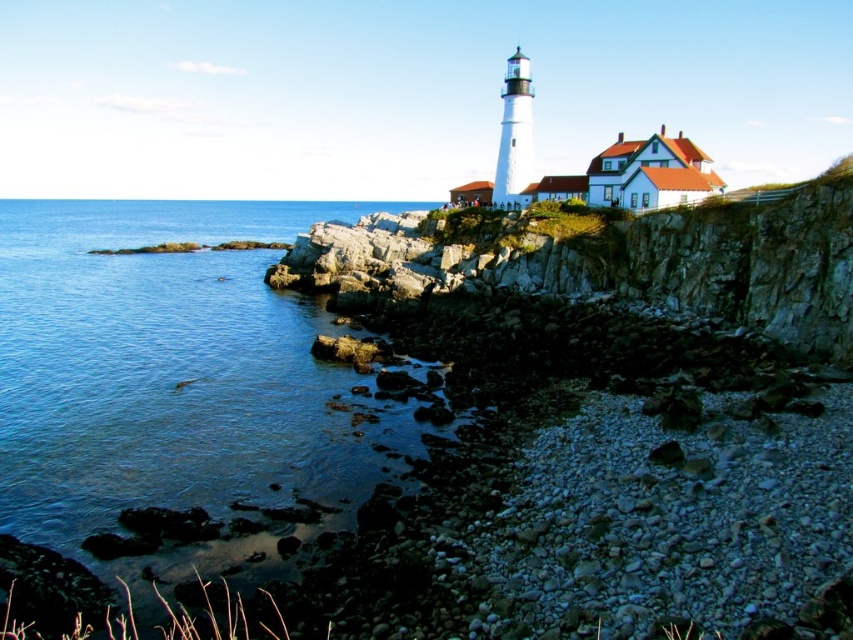
Question: Does blue water at lower left have a smaller size compared to rocky cliff at upper center?

Choices:
 (A) yes
 (B) no

Answer: (B)

Question: Can you confirm if blue water at lower left is positioned to the right of rocky cliff at upper center?

Choices:
 (A) no
 (B) yes

Answer: (A)

Question: Which point is closer to the camera?

Choices:
 (A) blue water at lower left
 (B) rocky cliff at upper center

Answer: (A)

Question: Is the position of blue water at lower left more distant than that of rocky cliff at upper center?

Choices:
 (A) no
 (B) yes

Answer: (A)

Question: Which point is farther to the camera?

Choices:
 (A) blue water at lower left
 (B) rocky cliff at upper center

Answer: (B)